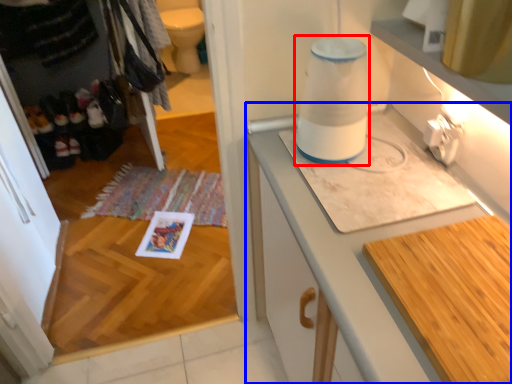
Question: Which object is closer to the camera taking this photo, blender (highlighted by a red box) or cabinetry (highlighted by a blue box)?

Choices:
 (A) blender
 (B) cabinetry

Answer: (B)